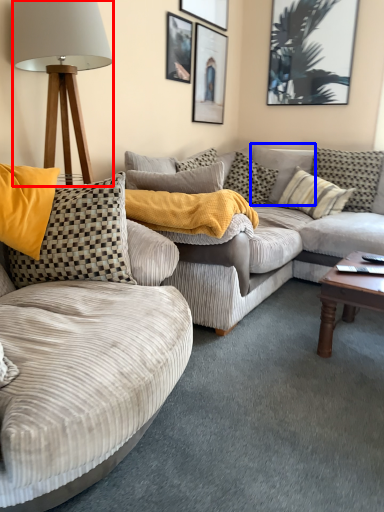
Question: Which object appears closest to the camera in this image, lamp (highlighted by a red box) or pillow (highlighted by a blue box)?

Choices:
 (A) lamp
 (B) pillow

Answer: (A)